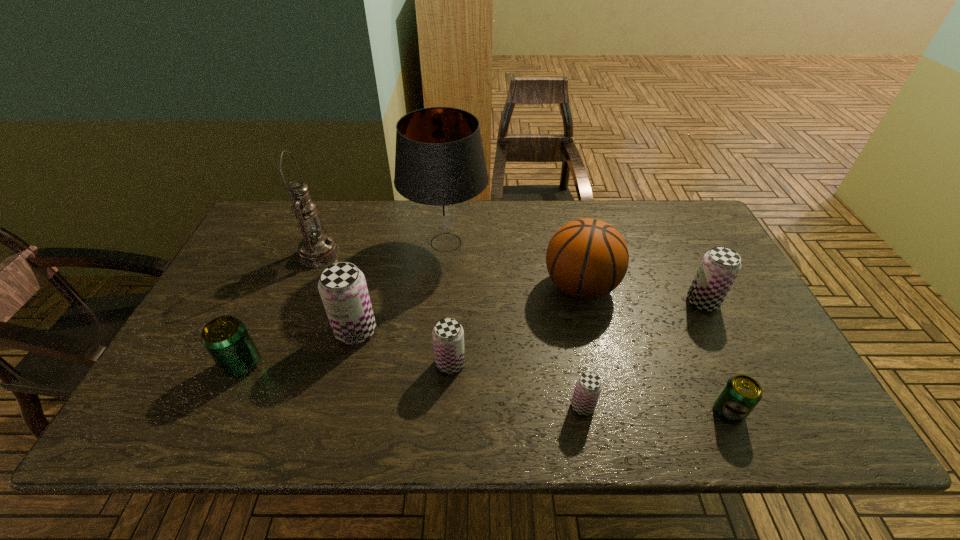
Where is `gray lampshade`? The width and height of the screenshot is (960, 540). gray lampshade is located at coordinates (440, 168).

Find the location of a particular element. The image size is (960, 540). oil lamp is located at coordinates (316, 249).

I want to click on basketball, so click(x=586, y=258).

What are the coordinates of `the biggest purple beer can` in the screenshot? It's located at (342, 286).

Where is `the third nearest purple beer can`? the third nearest purple beer can is located at coordinates (342, 286).

Where is `the farthest beer can`? The height and width of the screenshot is (540, 960). the farthest beer can is located at coordinates (720, 266).

Locate an element on the screen. the fifth tallest object is located at coordinates (720, 266).

Where is `the third purple beer can from right to left`? The width and height of the screenshot is (960, 540). the third purple beer can from right to left is located at coordinates (448, 335).

Identify the location of the second nearest purple beer can. (448, 335).

At what (x,y) coordinates should I click in order to perform the action: click on the bigger green beer can. Please return your answer as a coordinate pair (x, y). Looking at the image, I should click on (226, 339).